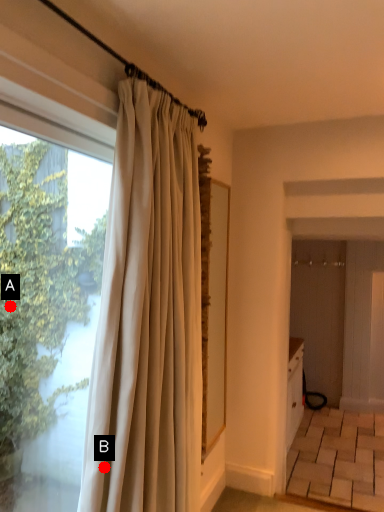
Question: Two points are circled on the image, labeled by A and B beside each circle. Which point appears closest to the camera in this image?

Choices:
 (A) A is closer
 (B) B is closer

Answer: (B)